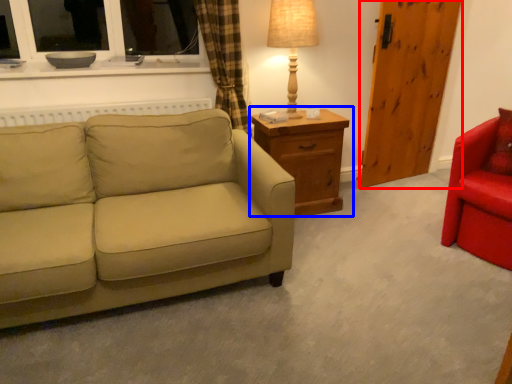
Question: Which object appears closest to the camera in this image, barn door (highlighted by a red box) or nightstand (highlighted by a blue box)?

Choices:
 (A) barn door
 (B) nightstand

Answer: (B)